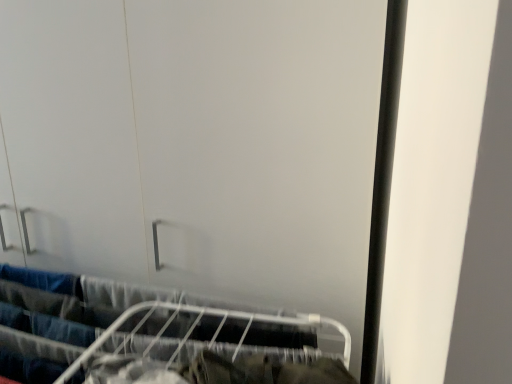
Locate an element on the screen. The image size is (512, 384). white plastic hanger at lower center is located at coordinates pyautogui.click(x=151, y=336).

Describe the element at coordinates (151, 336) in the screenshot. This screenshot has height=384, width=512. I see `white plastic hanger at lower center` at that location.

Consider the image. Measure the distance between point (x=19, y=297) and camera.

A distance of 3.51 feet exists between point (x=19, y=297) and camera.

I want to click on white plastic hanger at lower center, so click(x=151, y=336).